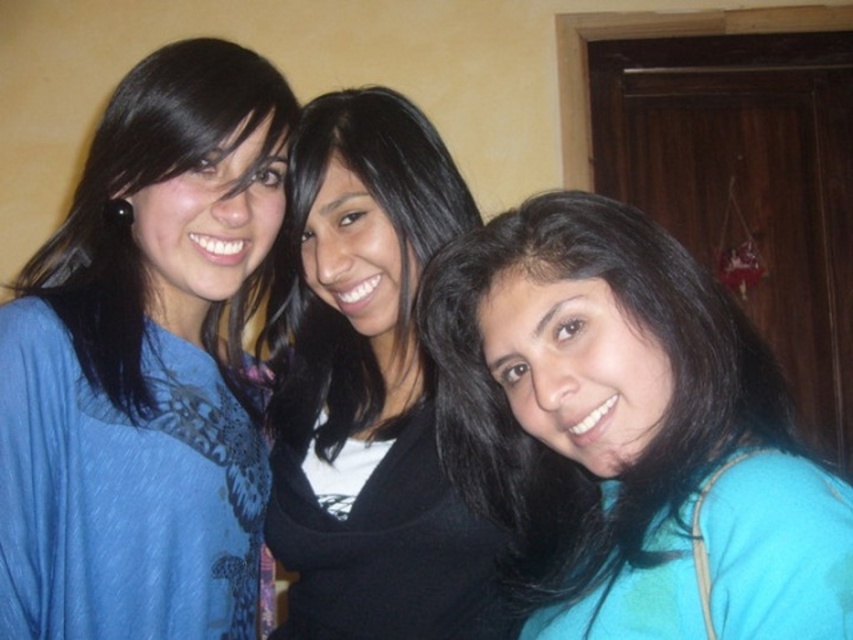
Is matte blue blouse at left closer to the viewer compared to teal fabric at center?

No, matte blue blouse at left is further to the viewer.

Where is `matte blue blouse at left`? The height and width of the screenshot is (640, 853). matte blue blouse at left is located at coordinates (144, 364).

Is point (241, 131) less distant than point (813, 513)?

No, (241, 131) is behind (813, 513).

The height and width of the screenshot is (640, 853). What are the coordinates of `matte blue blouse at left` in the screenshot? It's located at (144, 364).